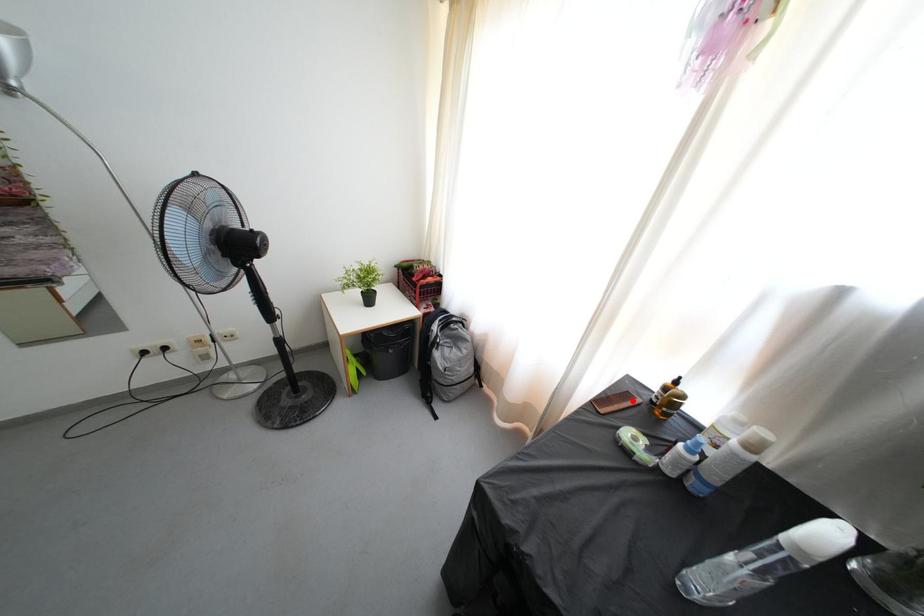
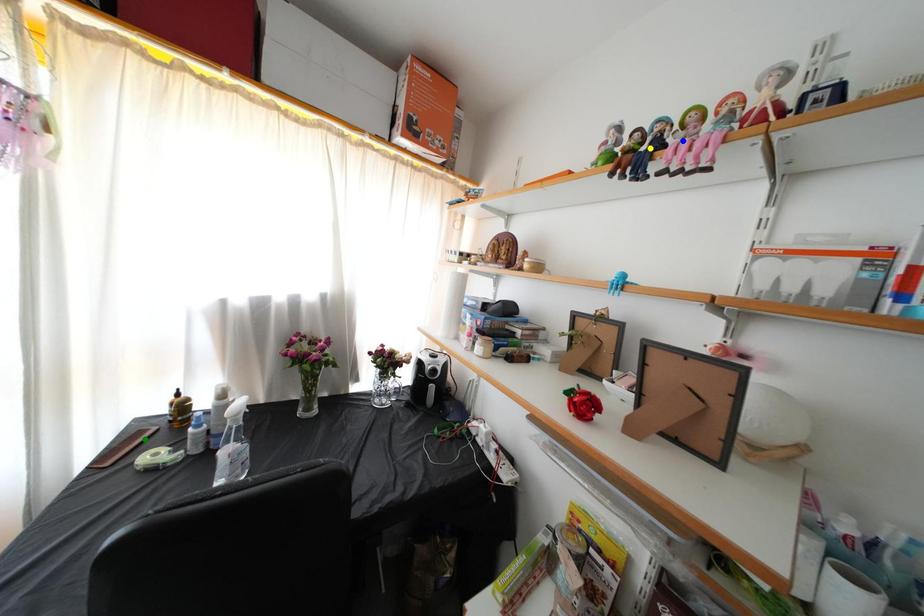
Question: I am providing you with two images of the same scene from different viewpoints. A red point is marked on the first image. You are given multiple points on the second image. Which point in image 2 represents the same 3d spot as the red point in image 1?

Choices:
 (A) green point
 (B) blue point
 (C) yellow point

Answer: (A)